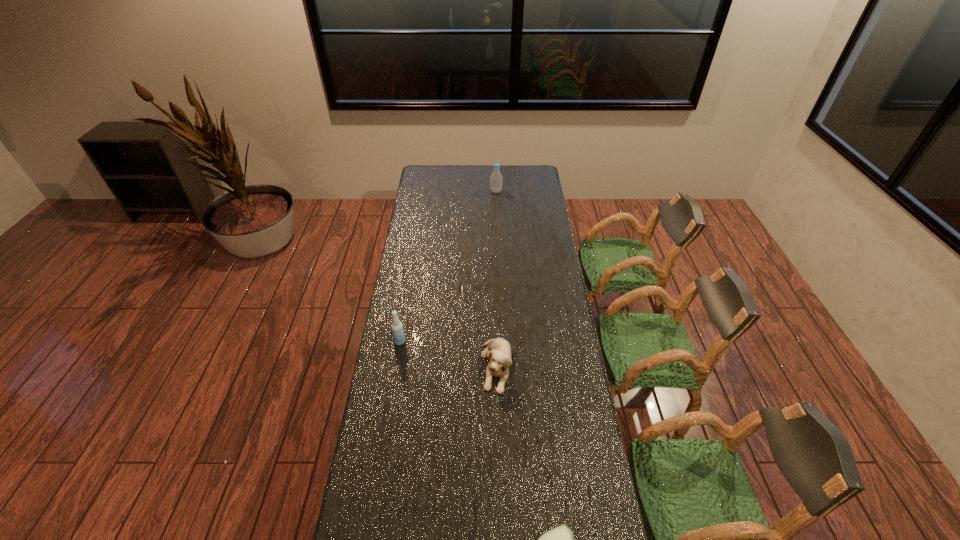
You are a GUI agent. You are given a task and a screenshot of the screen. Output one action in this format:
    pyautogui.click(x=<x>, y=<y>)
    Task: Click on the free location at the right edge of the desktop
    This screenshot has width=960, height=540.
    Given the screenshot: What is the action you would take?
    click(536, 318)

Where is `vacant region between the second farthest bottle and the puppy`? The height and width of the screenshot is (540, 960). vacant region between the second farthest bottle and the puppy is located at coordinates point(448,354).

Where is `vacant region between the farthest object and the leftmost object`? The image size is (960, 540). vacant region between the farthest object and the leftmost object is located at coordinates (448, 266).

Find the location of a particular element. The image size is (960, 540). vacant space in between the second shortest object and the farthest bottle is located at coordinates (496, 279).

Where is `unoccupied position between the puppy and the second nearest bottle`? The height and width of the screenshot is (540, 960). unoccupied position between the puppy and the second nearest bottle is located at coordinates (448, 354).

At what (x,y) coordinates should I click in order to perform the action: click on unoccupied position between the farthest bottle and the leftmost bottle. Please return your answer as a coordinate pair (x, y). The image size is (960, 540). Looking at the image, I should click on (x=448, y=266).

Find the location of a particular element. The height and width of the screenshot is (540, 960). object that is the third nearest to the second nearest bottle is located at coordinates (496, 179).

Where is `object that stands as the third closest to the farthest bottle`? object that stands as the third closest to the farthest bottle is located at coordinates (560, 539).

Where is `bottle that is the closest one to the nearest object`? This screenshot has height=540, width=960. bottle that is the closest one to the nearest object is located at coordinates (397, 328).

At what (x,y) coordinates should I click in order to perform the action: click on bottle that is the closest one to the farthest bottle. Please return your answer as a coordinate pair (x, y). The image size is (960, 540). Looking at the image, I should click on (397, 328).